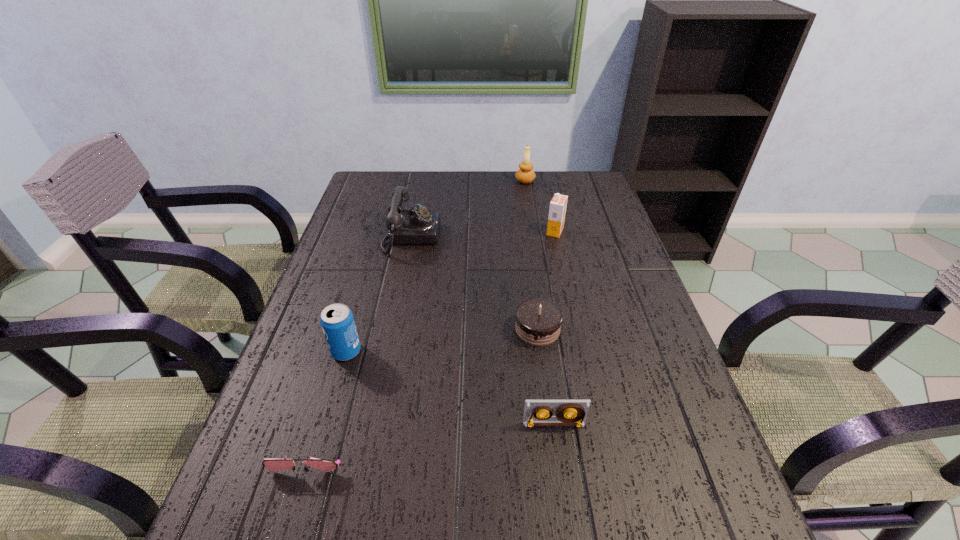
Find the location of a particular element. The width and height of the screenshot is (960, 540). the farthest object is located at coordinates (525, 174).

Where is `telephone`? The image size is (960, 540). telephone is located at coordinates (417, 226).

Image resolution: width=960 pixels, height=540 pixels. In order to click on soda can in this screenshot , I will do `click(337, 321)`.

I want to click on orange juice, so click(x=558, y=204).

Identify the location of chocolate cake. This screenshot has width=960, height=540. pos(538,321).

Find the location of a particular element. videotape is located at coordinates (537, 412).

Locate an element on the screen. The width and height of the screenshot is (960, 540). vacant space situated on the left of the farthest object is located at coordinates (432, 181).

Find the location of a particular element. The width and height of the screenshot is (960, 540). free space located 0.090m on the dial of the telephone is located at coordinates (469, 237).

Identify the location of vacant area situated on the back of the soda can. Image resolution: width=960 pixels, height=540 pixels. (360, 304).

This screenshot has height=540, width=960. Identify the location of free space located on the right of the orange juice. (597, 232).